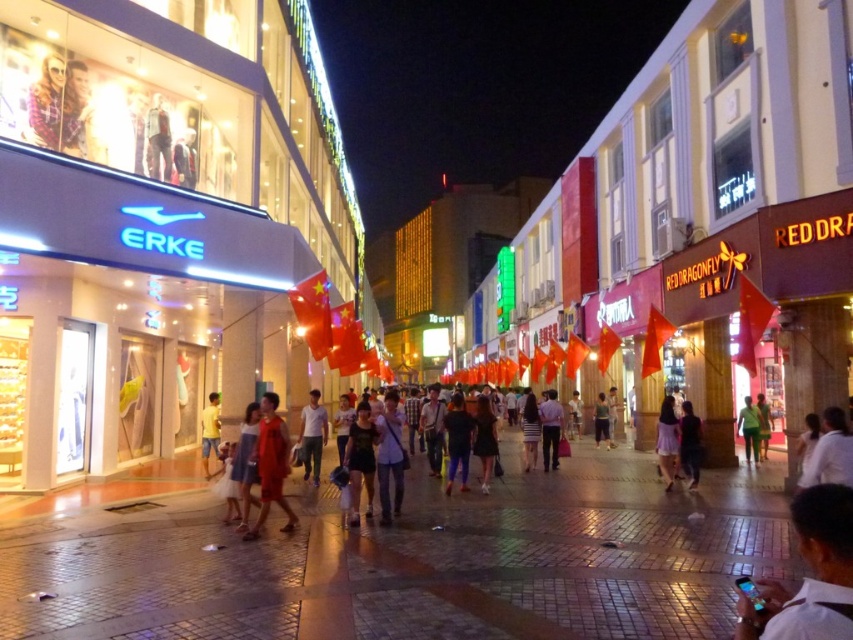
You are standing at the point marked as point (x=210, y=432) in the image. What item is located exactly at that point?

The yellow cotton shorts at center are located exactly at point (x=210, y=432).

You are a delivery person with a cart that is 2 meters wide. You need to navigate between the white shirt at center and the yellow cotton shorts at center. Can your cart fit through the space between them?

The distance between the white shirt at center and the yellow cotton shorts at center is 17.74 meters. Since your cart is only 2 meters wide, it can easily fit through the space between them.